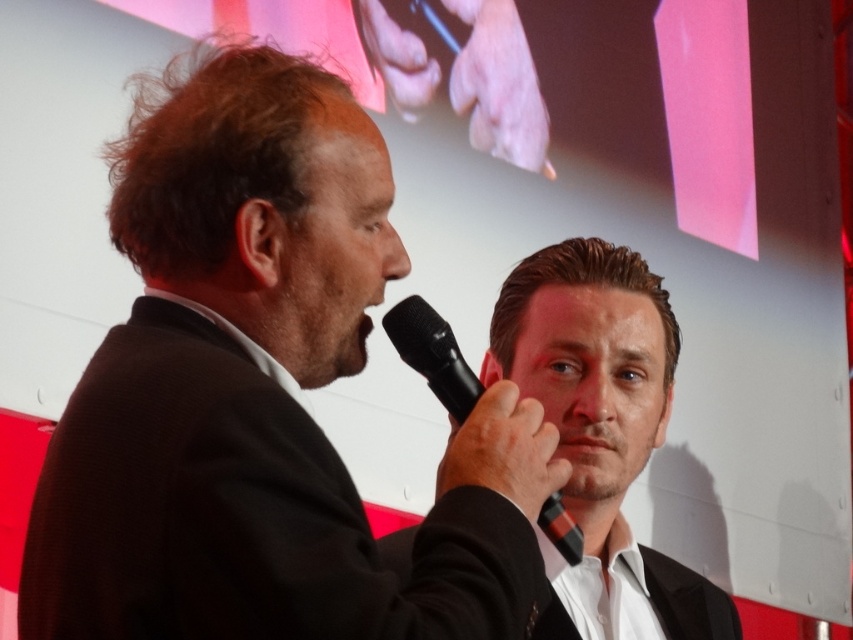
Question: Among these objects, which one is nearest to the camera?

Choices:
 (A) black plastic microphone at center
 (B) smooth black suit at center
 (C) black matte suit at left

Answer: (C)

Question: From the image, what is the correct spatial relationship of black matte suit at left in relation to black plastic microphone at center?

Choices:
 (A) left
 (B) right

Answer: (A)

Question: Which of the following is the closest to the observer?

Choices:
 (A) (143, 422)
 (B) (633, 380)
 (C) (572, 532)

Answer: (A)

Question: Does black matte suit at left appear on the right side of smooth black suit at center?

Choices:
 (A) yes
 (B) no

Answer: (B)

Question: Which point is farther to the camera?

Choices:
 (A) black plastic microphone at center
 (B) black matte suit at left
 (C) smooth black suit at center

Answer: (C)

Question: Is smooth black suit at center to the left of black plastic microphone at center from the viewer's perspective?

Choices:
 (A) no
 (B) yes

Answer: (A)